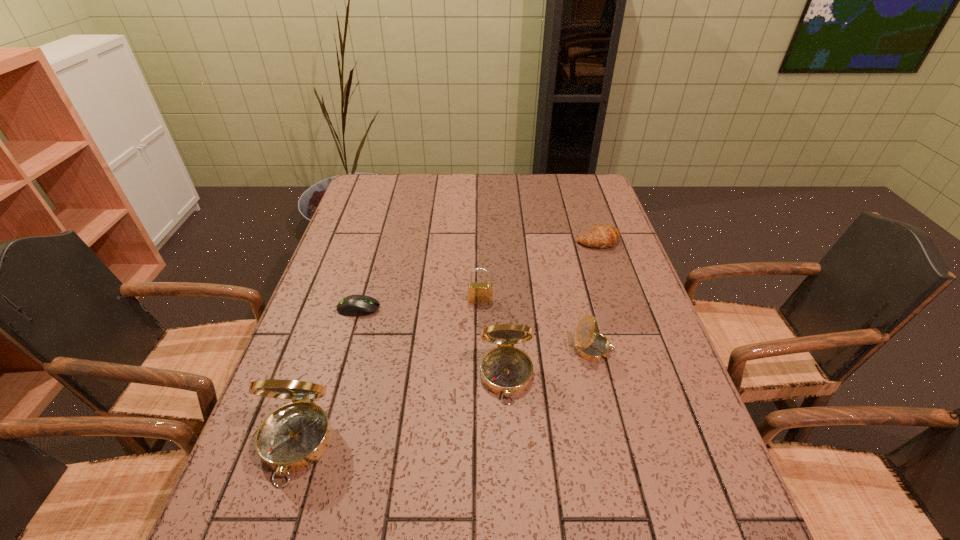
Locate an element on the screen. The width and height of the screenshot is (960, 540). free space at the near edge of the desktop is located at coordinates (591, 474).

This screenshot has height=540, width=960. Identify the location of vacant space at the left edge. (342, 314).

Find the location of a particular element. blank area at the right edge is located at coordinates (634, 321).

What are the coordinates of `blank space at the far left corner of the desktop` in the screenshot? It's located at (380, 178).

Where is `vacant space at the far right corner of the desktop`? Image resolution: width=960 pixels, height=540 pixels. vacant space at the far right corner of the desktop is located at coordinates (595, 183).

Identify the location of vacant area that lies between the crescent roll and the second tallest object. Image resolution: width=960 pixels, height=540 pixels. (552, 309).

You are a GUI agent. You are given a task and a screenshot of the screen. Output one action in this format:
    pyautogui.click(x=<x>, y=<y>)
    Task: Click on the free point between the second tallest compass and the crescent roll
    
    Given the screenshot: What is the action you would take?
    pyautogui.click(x=552, y=309)

The width and height of the screenshot is (960, 540). In order to click on free space that is in between the crescent roll and the nearest object in this screenshot , I will do `click(446, 343)`.

I want to click on free space between the crescent roll and the computer mouse, so tap(478, 275).

Locate an element on the screen. The image size is (960, 540). unoccupied area between the nearest compass and the second compass from left to right is located at coordinates (401, 410).